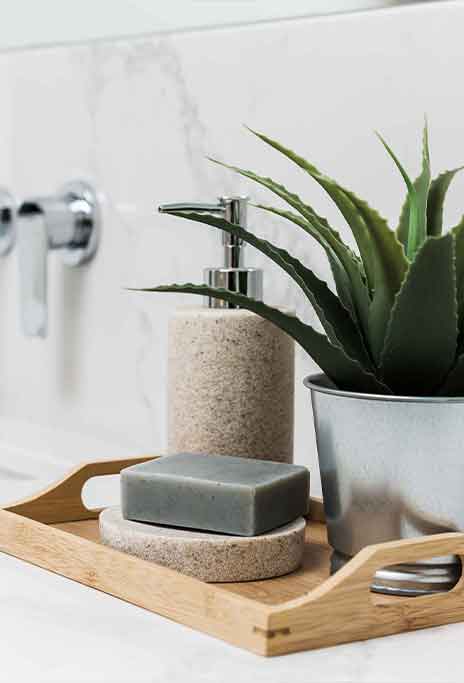
Where is `silver pot`? The image size is (464, 683). silver pot is located at coordinates pos(357,446).